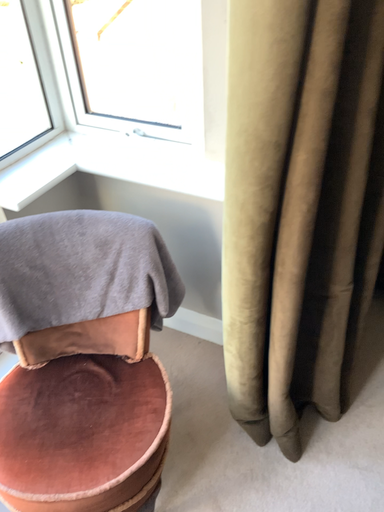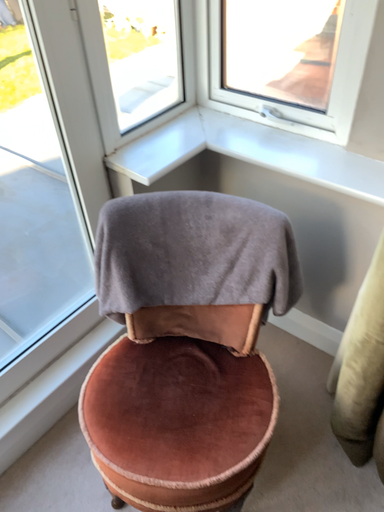
Question: How did the camera likely rotate when shooting the video?

Choices:
 (A) rotated left
 (B) rotated right

Answer: (A)